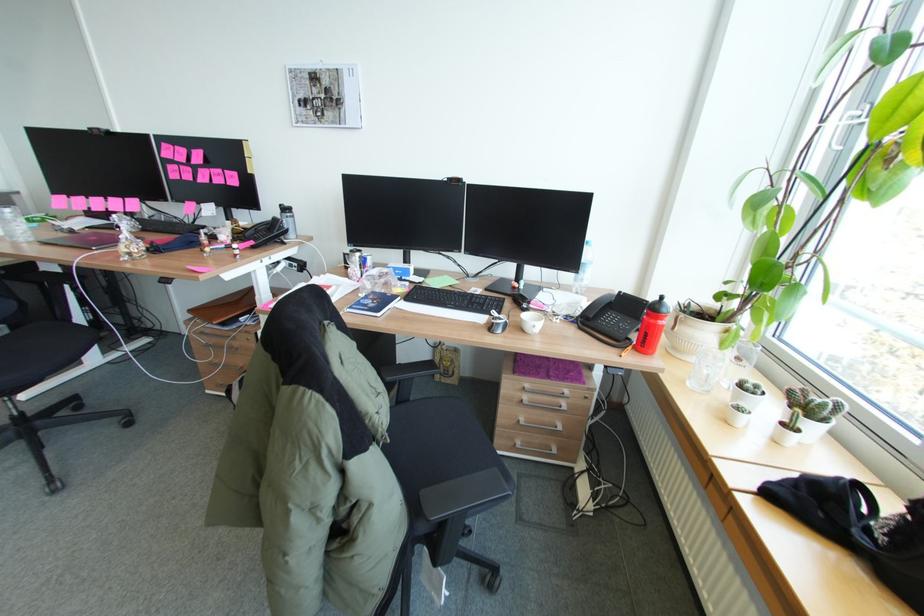
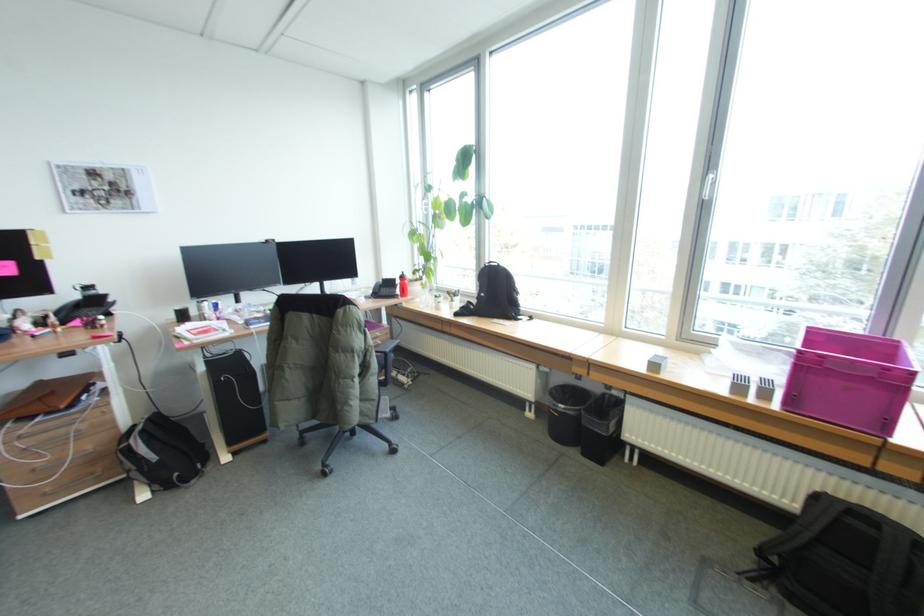
Where in the second image is the point corresponding to point 238,384 from the first image?

(135, 444)